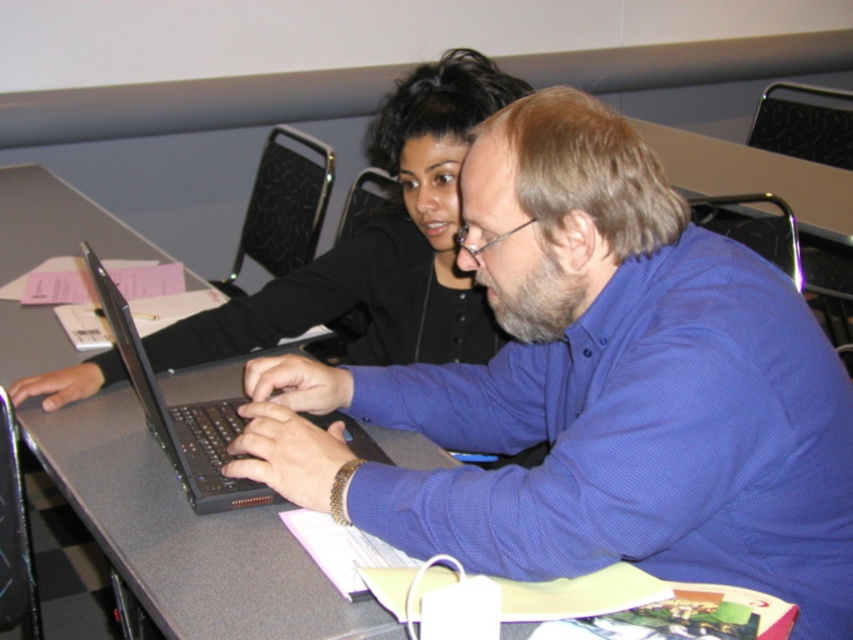
Question: Which point is farther to the camera?

Choices:
 (A) (515, 259)
 (B) (399, 289)
 (C) (157, 436)

Answer: (B)

Question: Can you confirm if blue matte shirt at center is positioned to the left of black matte laptop at center?

Choices:
 (A) no
 (B) yes

Answer: (A)

Question: In this image, where is blue matte shirt at center located relative to black matte shirt at upper center?

Choices:
 (A) left
 (B) right

Answer: (B)

Question: Which point is closer to the camera?

Choices:
 (A) (99, 269)
 (B) (422, 236)
 (C) (585, 300)

Answer: (C)

Question: Considering the relative positions of black matte shirt at upper center and black matte laptop at center in the image provided, where is black matte shirt at upper center located with respect to black matte laptop at center?

Choices:
 (A) left
 (B) right

Answer: (B)

Question: Which of the following is the closest to the observer?

Choices:
 (A) (351, 257)
 (B) (737, 333)

Answer: (B)